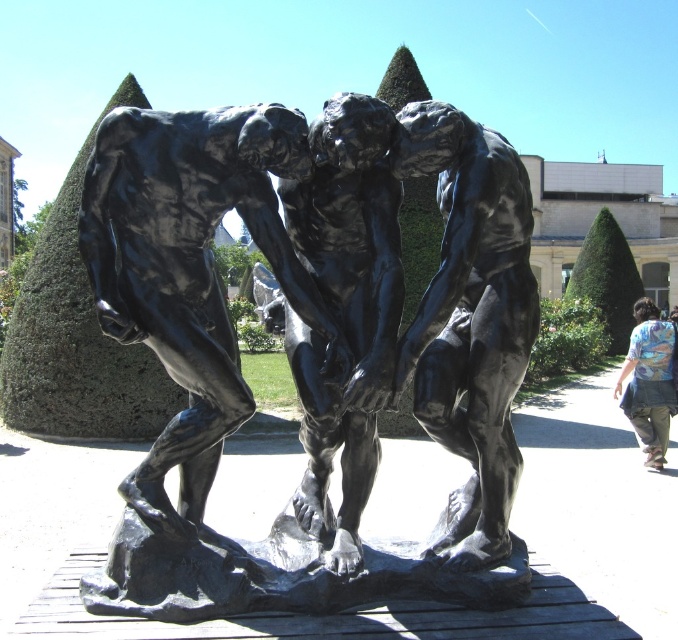
You are an art curator planning to display both the black polished stone sculpture at center and the floral shirt at lower right in a gallery. Based on their sizes, which object should be placed in a more prominent location to emphasize its significance?

The black polished stone sculpture at center should be placed in a more prominent location because it has a larger size compared to the floral shirt at lower right, making it visually dominant and attention grabbing.